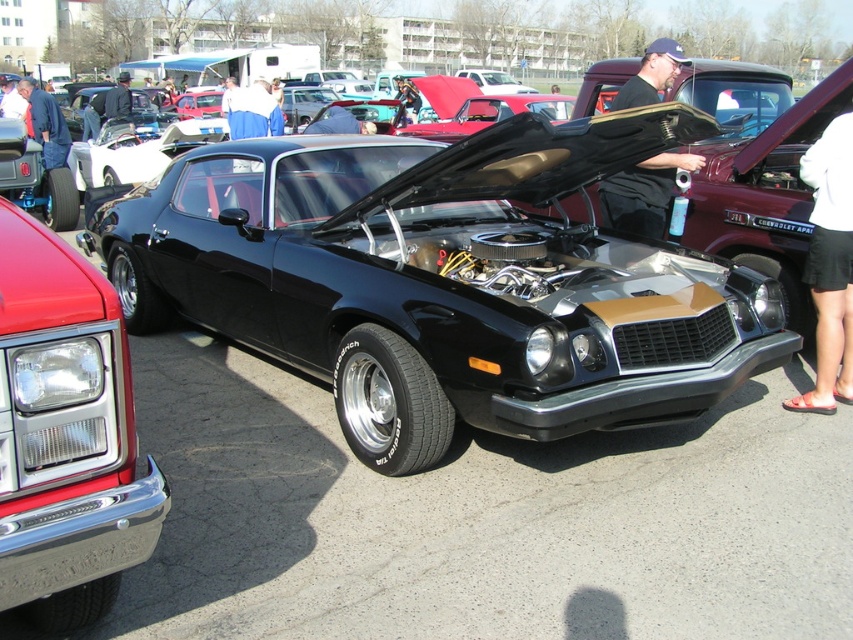
Question: Is shiny chrome bumper at lower left closer to the viewer compared to white fabric shorts at right?

Choices:
 (A) no
 (B) yes

Answer: (B)

Question: Is white fabric shorts at right wider than black fabric shirt at upper center?

Choices:
 (A) yes
 (B) no

Answer: (B)

Question: Does white fabric shorts at right have a smaller size compared to dark blue jacket at upper left?

Choices:
 (A) yes
 (B) no

Answer: (A)

Question: Which object is positioned closest to the shiny chrome bumper at lower left?

Choices:
 (A) dark blue jacket at upper left
 (B) blue denim jacket at upper left
 (C) black fabric shirt at upper center
 (D) white fabric shorts at right

Answer: (D)

Question: Which object is closer to the camera taking this photo?

Choices:
 (A) black fabric shirt at upper center
 (B) dark blue jacket at upper left

Answer: (A)

Question: Which of these objects is positioned farthest from the dark blue jacket at upper left?

Choices:
 (A) black fabric shirt at upper center
 (B) shiny chrome bumper at lower left
 (C) blue denim jacket at upper left

Answer: (A)